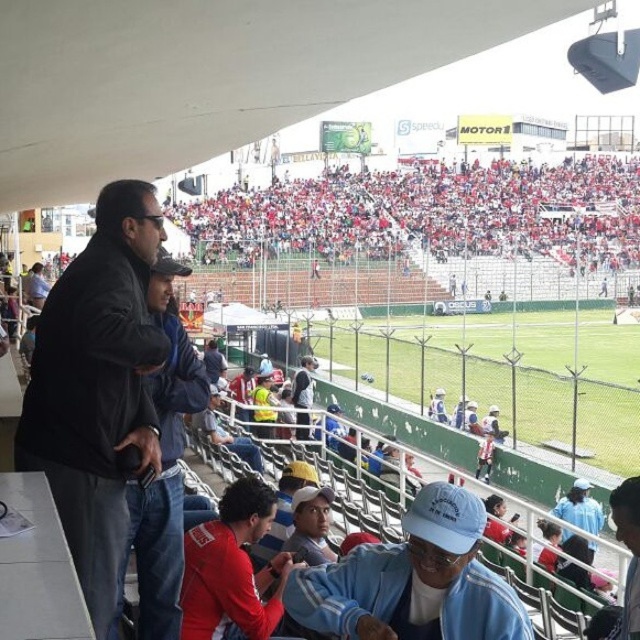
You are a photographer positioned at the edge of the stadium field, aiming to capture a photo that includes both the black leather jacket at left and the light blue fabric jacket at lower center. To ensure both jackets are in the frame, should you adjust your camera to focus more to the left or to the right?

The black leather jacket at left is to the left of the light blue fabric jacket at lower center. Therefore, to include both in the frame, you should adjust your camera to focus more to the left to capture the black leather jacket at left and then ensure the light blue fabric jacket at lower center is also within the view.

You are standing at the entrance of the stadium and see two points marked in the image. Which point, point [371,566] or point [298,436], is closer to you?

Point [371,566] is closer to the viewer than point [298,436].